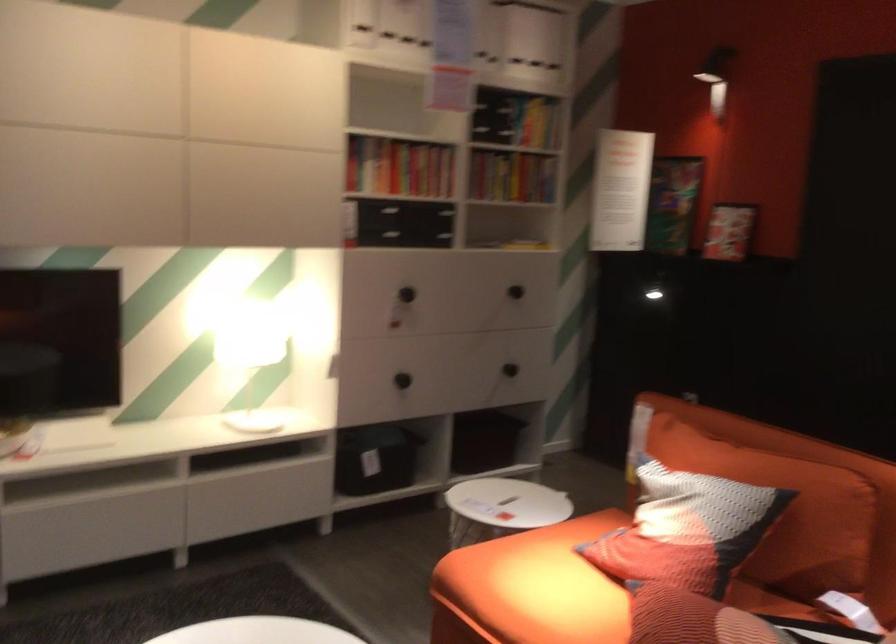
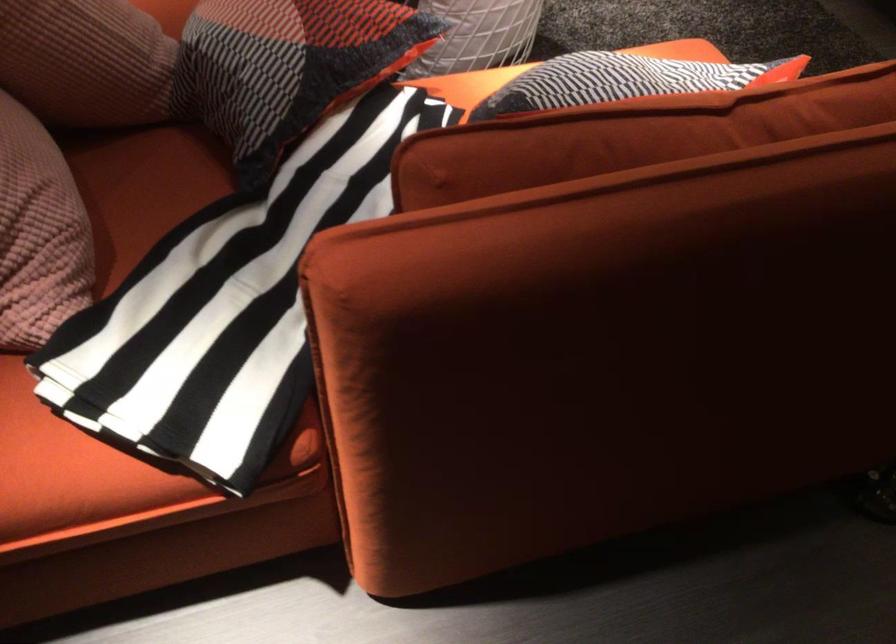
In the second image, find the point that corresponds to point 727,473 in the first image.

(623, 80)